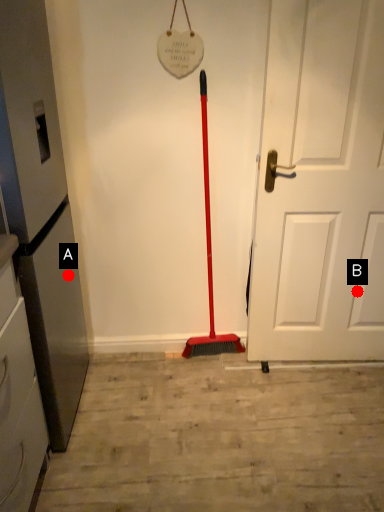
Question: Two points are circled on the image, labeled by A and B beside each circle. Which point is closer to the camera taking this photo?

Choices:
 (A) A is closer
 (B) B is closer

Answer: (A)